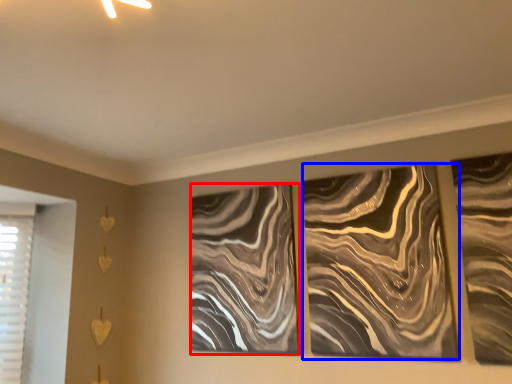
Question: Which point is further to the camera, design (highlighted by a red box) or design (highlighted by a blue box)?

Choices:
 (A) design
 (B) design

Answer: (A)